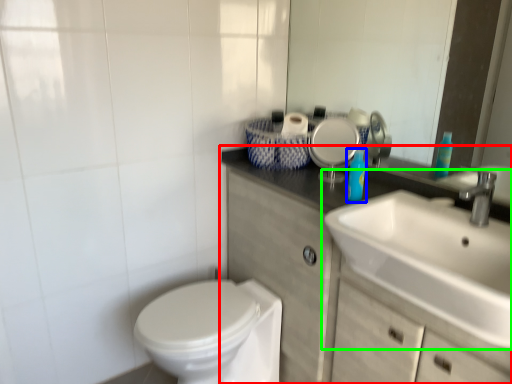
Question: Which object is positioned farthest from bathroom cabinet (highlighted by a red box)? Select from toiletry (highlighted by a blue box) and sink (highlighted by a green box).

Choices:
 (A) toiletry
 (B) sink

Answer: (A)